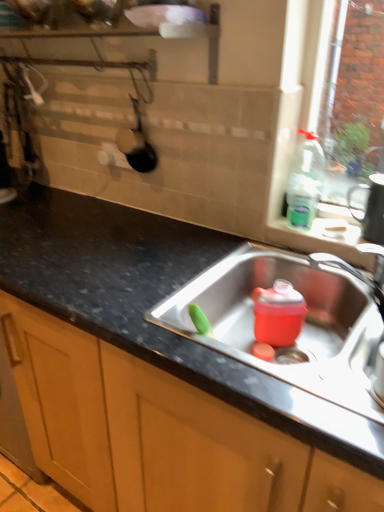
Question: Is metallic silver tap at right at the back of black granite countertop at center?

Choices:
 (A) no
 (B) yes

Answer: (A)

Question: Does black granite countertop at center have a greater width compared to metallic silver tap at right?

Choices:
 (A) no
 (B) yes

Answer: (B)

Question: Considering the relative sizes of black granite countertop at center and metallic silver tap at right in the image provided, is black granite countertop at center bigger than metallic silver tap at right?

Choices:
 (A) no
 (B) yes

Answer: (B)

Question: Is black granite countertop at center shorter than metallic silver tap at right?

Choices:
 (A) yes
 (B) no

Answer: (B)

Question: From a real-world perspective, is black granite countertop at center positioned under metallic silver tap at right based on gravity?

Choices:
 (A) no
 (B) yes

Answer: (B)

Question: Considering the positions of black granite countertop at center and metallic silver tap at right in the image, is black granite countertop at center taller or shorter than metallic silver tap at right?

Choices:
 (A) tall
 (B) short

Answer: (A)

Question: Is black granite countertop at center situated inside metallic silver tap at right or outside?

Choices:
 (A) inside
 (B) outside

Answer: (B)

Question: Is black granite countertop at center bigger or smaller than metallic silver tap at right?

Choices:
 (A) big
 (B) small

Answer: (A)

Question: Considering their positions, is black granite countertop at center located in front of or behind metallic silver tap at right?

Choices:
 (A) front
 (B) behind

Answer: (A)

Question: Based on their positions, is black matte mug at upper right located to the left or right of stainless steel sink at center?

Choices:
 (A) right
 (B) left

Answer: (A)

Question: Looking at the image, does black matte mug at upper right seem bigger or smaller compared to stainless steel sink at center?

Choices:
 (A) small
 (B) big

Answer: (A)

Question: From a real-world perspective, relative to stainless steel sink at center, is black matte mug at upper right vertically above or below?

Choices:
 (A) above
 (B) below

Answer: (A)

Question: Is black matte mug at upper right inside the boundaries of stainless steel sink at center, or outside?

Choices:
 (A) outside
 (B) inside

Answer: (A)

Question: Is point (223, 329) positioned closer to the camera than point (372, 189)?

Choices:
 (A) farther
 (B) closer

Answer: (B)

Question: Is stainless steel sink at center in front of or behind black matte mug at upper right in the image?

Choices:
 (A) front
 (B) behind

Answer: (A)